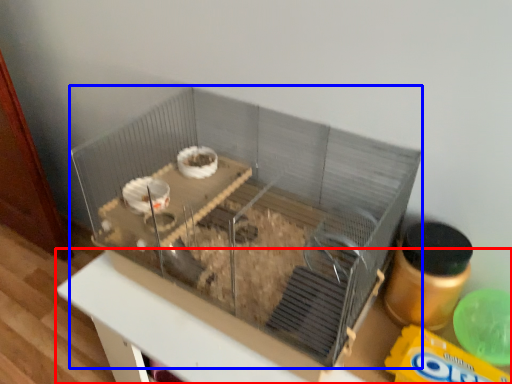
Question: Which object is further to the camera taking this photo, table (highlighted by a red box) or glass box (highlighted by a blue box)?

Choices:
 (A) table
 (B) glass box

Answer: (A)